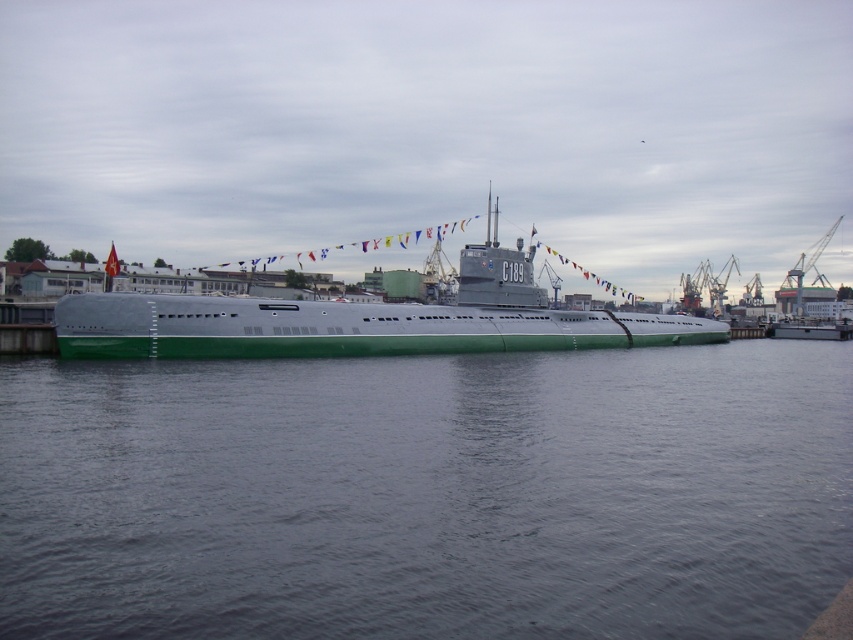
Is green matte water at center bigger than green matte submarine at center?

Incorrect, green matte water at center is not larger than green matte submarine at center.

Looking at this image, does green matte water at center appear on the right side of green matte submarine at center?

No, green matte water at center is not to the right of green matte submarine at center.

Between point (352, 420) and point (369, 346), which one is positioned in front?

Positioned in front is point (352, 420).

The image size is (853, 640). I want to click on green matte water at center, so click(428, 493).